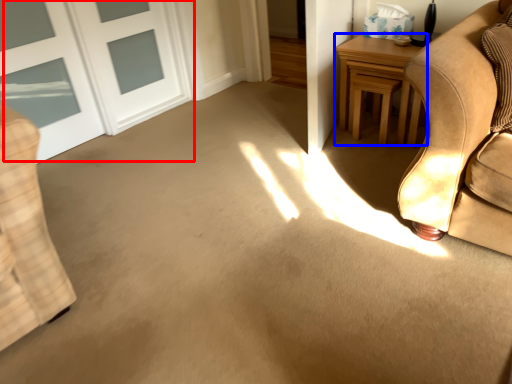
Question: Among these objects, which one is farthest to the camera, door (highlighted by a red box) or table (highlighted by a blue box)?

Choices:
 (A) door
 (B) table

Answer: (B)